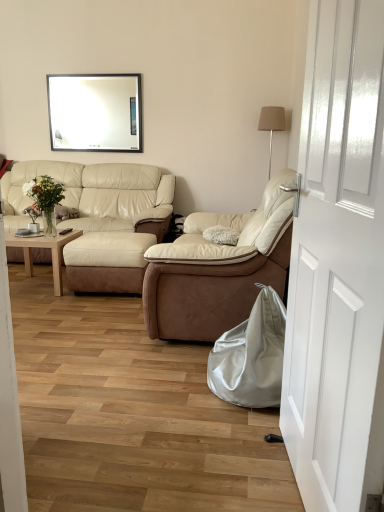
Question: Can you confirm if satin silver bean bag at lower right is smaller than beige leather recliner at center, which is the 2th studio couch from left to right?

Choices:
 (A) yes
 (B) no

Answer: (A)

Question: Does satin silver bean bag at lower right turn towards beige leather recliner at center, arranged as the 2th studio couch when viewed from the back?

Choices:
 (A) yes
 (B) no

Answer: (B)

Question: From a real-world perspective, does satin silver bean bag at lower right stand above beige leather recliner at center, the 1th studio couch from the front?

Choices:
 (A) yes
 (B) no

Answer: (B)

Question: Does satin silver bean bag at lower right have a greater width compared to beige leather recliner at center, arranged as the 2th studio couch when viewed from the back?

Choices:
 (A) no
 (B) yes

Answer: (A)

Question: Is satin silver bean bag at lower right positioned far away from beige leather recliner at center, arranged as the 2th studio couch when viewed from the back?

Choices:
 (A) no
 (B) yes

Answer: (A)

Question: Is beige leather recliner at center, arranged as the 2th studio couch when viewed from the back, a part of satin silver bean bag at lower right?

Choices:
 (A) yes
 (B) no

Answer: (B)

Question: Could you tell me if beige leather couch at center, the 2th studio couch in the right-to-left sequence, is facing satin silver bean bag at lower right?

Choices:
 (A) yes
 (B) no

Answer: (A)

Question: From a real-world perspective, is beige leather couch at center, the 1th studio couch from the left, physically above satin silver bean bag at lower right?

Choices:
 (A) yes
 (B) no

Answer: (A)

Question: From a real-world perspective, is beige leather couch at center, the 1th studio couch from the left, beneath satin silver bean bag at lower right?

Choices:
 (A) yes
 (B) no

Answer: (B)

Question: Is beige leather couch at center, the 1th studio couch from the left, shorter than satin silver bean bag at lower right?

Choices:
 (A) no
 (B) yes

Answer: (A)

Question: Are beige leather couch at center, the second studio couch in the front-to-back sequence, and satin silver bean bag at lower right far apart?

Choices:
 (A) no
 (B) yes

Answer: (B)

Question: Is beige leather couch at center, the second studio couch in the front-to-back sequence, not within satin silver bean bag at lower right?

Choices:
 (A) yes
 (B) no

Answer: (A)

Question: Does beige leather couch at center, the 2th studio couch in the right-to-left sequence, have a lesser height compared to beige leather recliner at center, which is the 2th studio couch from left to right?

Choices:
 (A) yes
 (B) no

Answer: (A)